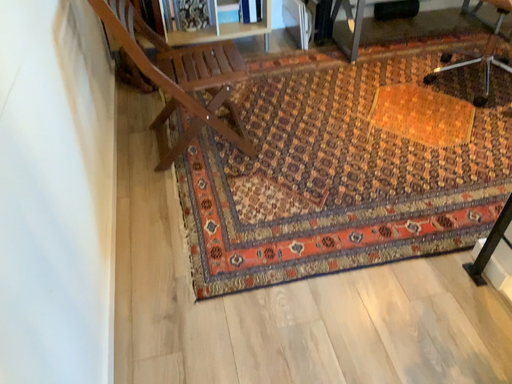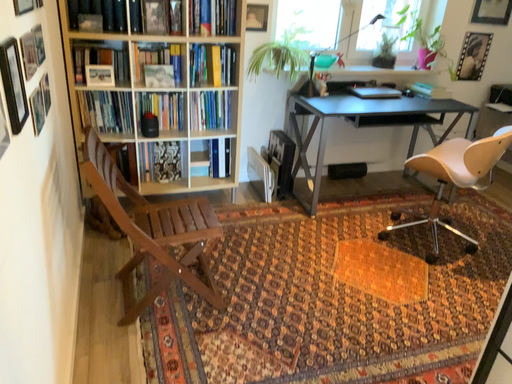
Question: Which way did the camera rotate in the video?

Choices:
 (A) rotated upward
 (B) rotated downward

Answer: (A)